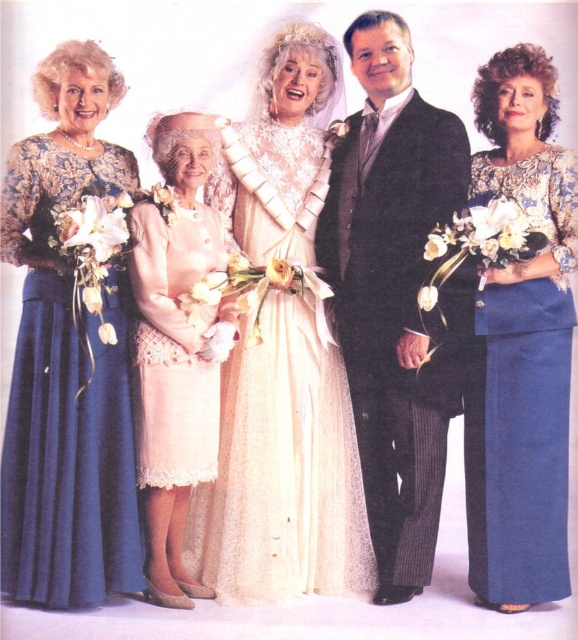
Is point (453, 120) behind point (150, 220)?

Yes, it is behind point (150, 220).

Who is more distant from viewer, (427, 570) or (162, 589)?

The point (427, 570) is behind.

At what (x,y) coordinates should I click in order to perform the action: click on dark gray pinstripe suit at center. Please return your answer as a coordinate pair (x, y). The height and width of the screenshot is (640, 578). Looking at the image, I should click on (392, 292).

Who is more forward, (520,406) or (166,220)?

Point (520,406)

Measure the distance from blue satin dress at right to light pink lace dress at center.

The distance of blue satin dress at right from light pink lace dress at center is 30.87 inches.

Between point (550, 150) and point (180, 428), which one is positioned behind?

Point (550, 150)

Where is `blue satin dress at right`? blue satin dress at right is located at coordinates (521, 394).

What do you see at coordinates (392, 292) in the screenshot? Image resolution: width=578 pixels, height=640 pixels. I see `dark gray pinstripe suit at center` at bounding box center [392, 292].

Between dark gray pinstripe suit at center and matte blue dress at left, which one is positioned lower?

matte blue dress at left is below.

Is point (427, 182) closer to camera compared to point (36, 339)?

No.

This screenshot has height=640, width=578. Find the location of `dark gray pinstripe suit at center`. dark gray pinstripe suit at center is located at coordinates (392, 292).